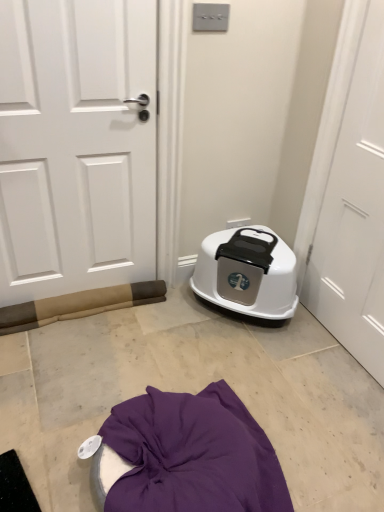
Identify the location of free space between white matte door at right, arranged as the second door when viewed from the left, and white plastic litter box at center. The height and width of the screenshot is (512, 384). 303,349.